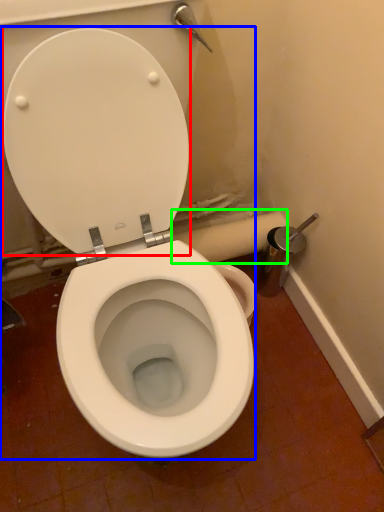
Question: Based on their relative distances, which object is nearer to back (highlighted by a red box)? Choose from toilet (highlighted by a blue box) and toilet paper (highlighted by a green box).

Choices:
 (A) toilet
 (B) toilet paper

Answer: (A)